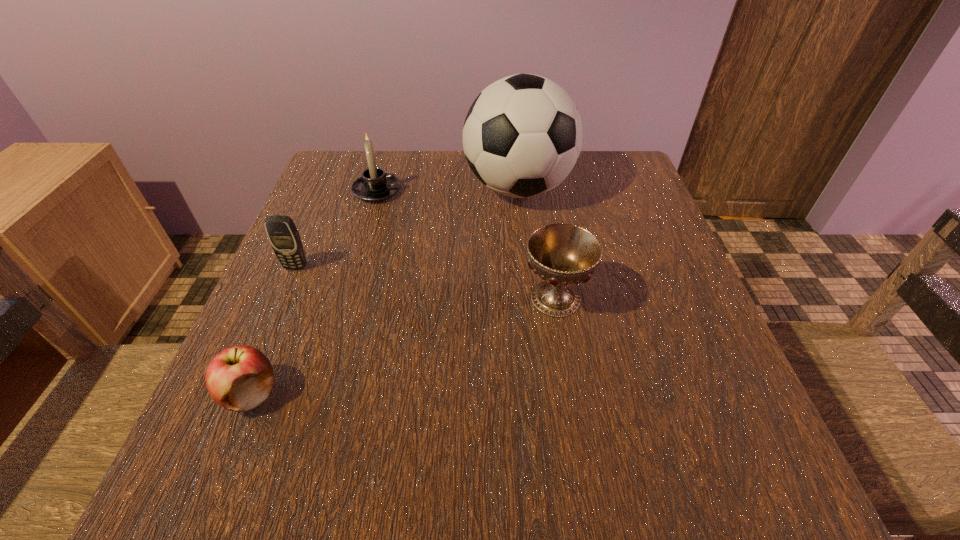
Where is `free space between the tallest object and the cellular telephone`? This screenshot has height=540, width=960. free space between the tallest object and the cellular telephone is located at coordinates (407, 227).

The width and height of the screenshot is (960, 540). In order to click on free space between the third nearest object and the shortest object in this screenshot , I will do `click(274, 330)`.

I want to click on vacant region between the cellular telephone and the fourth shortest object, so click(336, 229).

In order to click on free space between the apple and the fourth farthest object in this screenshot , I will do `click(403, 346)`.

Identify which object is located as the third nearest to the candle holder. Please provide its 2D coordinates. Your answer should be formatted as a tuple, i.e. [(x, y)], where the tuple contains the x and y coordinates of a point satisfying the conditions above.

[(563, 255)]

Find the location of a particular element. This screenshot has width=960, height=540. object that is the fourth closest one to the chalice is located at coordinates (283, 235).

Identify the location of vacant space that satisfies the following two spatial constraints: 1. with a handle on the side of the second tallest object; 2. on the front face of the cellular telephone. pos(355,267).

In order to click on free space that satisfies the following two spatial constraints: 1. with a handle on the side of the third object from left to right; 2. on the front face of the third nearest object in this screenshot , I will do `click(355, 267)`.

Locate an element on the screen. free space that satisfies the following two spatial constraints: 1. on the back side of the chalice; 2. on the left side of the shortest object is located at coordinates (290, 298).

Identify the location of vacant space that satisfies the following two spatial constraints: 1. with a handle on the side of the candle holder; 2. on the front face of the cellular telephone. (355, 267).